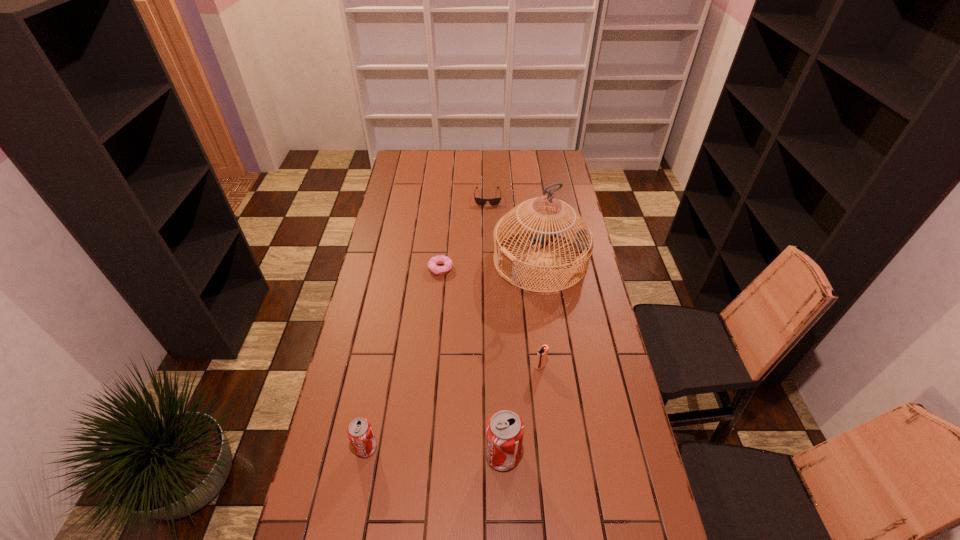
Locate an element on the screen. The width and height of the screenshot is (960, 540). free space located 0.130m on the front of the fifth shortest object is located at coordinates (506, 525).

Where is `vacant position located 0.100m on the left of the igniter`? vacant position located 0.100m on the left of the igniter is located at coordinates (505, 367).

The image size is (960, 540). I want to click on vacant region located on the right of the doughnut, so click(507, 268).

Locate an element on the screen. The height and width of the screenshot is (540, 960). vacant space situated 0.060m on the front-facing side of the farthest object is located at coordinates (488, 214).

Image resolution: width=960 pixels, height=540 pixels. Find the location of `free space located 0.220m on the front of the tallest object`. free space located 0.220m on the front of the tallest object is located at coordinates (552, 340).

This screenshot has width=960, height=540. I want to click on object located at the left edge, so click(360, 433).

Locate an element on the screen. object positioned at the right edge is located at coordinates (582, 241).

Find the location of a particular element. This screenshot has height=540, width=960. free space at the far edge is located at coordinates (466, 153).

Where is `vacant space at the near edge`? vacant space at the near edge is located at coordinates (486, 516).

Find the location of a particular element. The height and width of the screenshot is (540, 960). free point at the left edge is located at coordinates (362, 290).